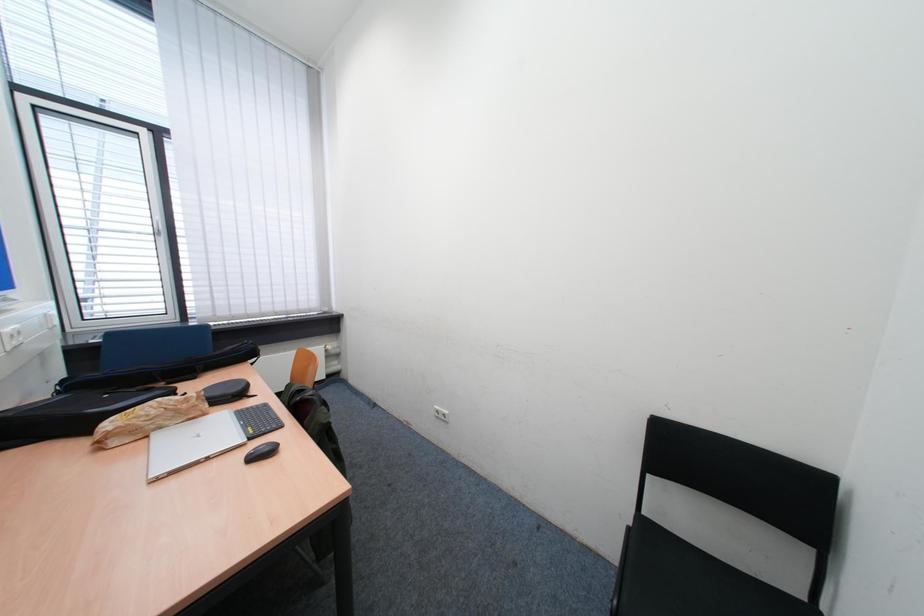
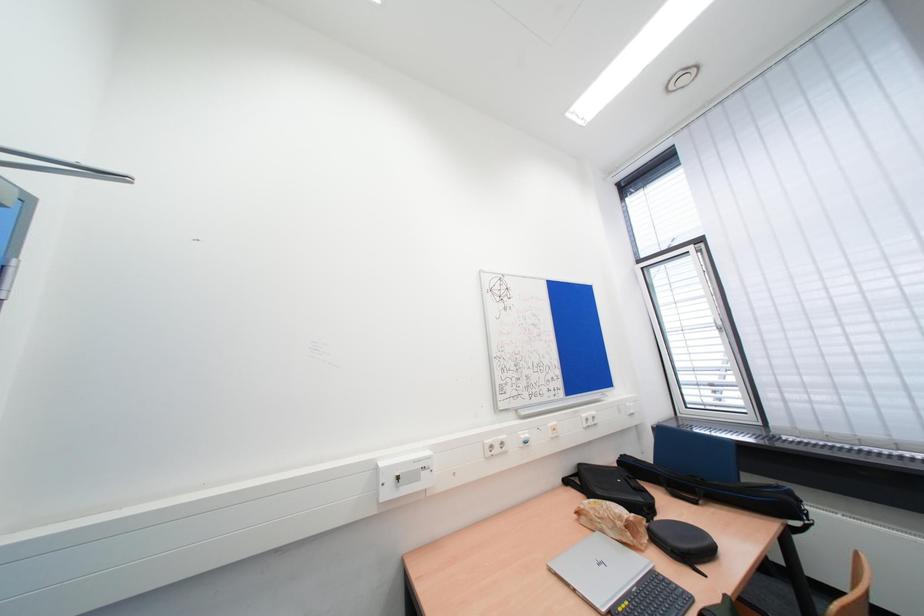
Question: The first image is from the beginning of the video and the second image is from the end. How did the camera likely rotate when shooting the video?

Choices:
 (A) Left
 (B) Right
 (C) Up
 (D) Down

Answer: (A)